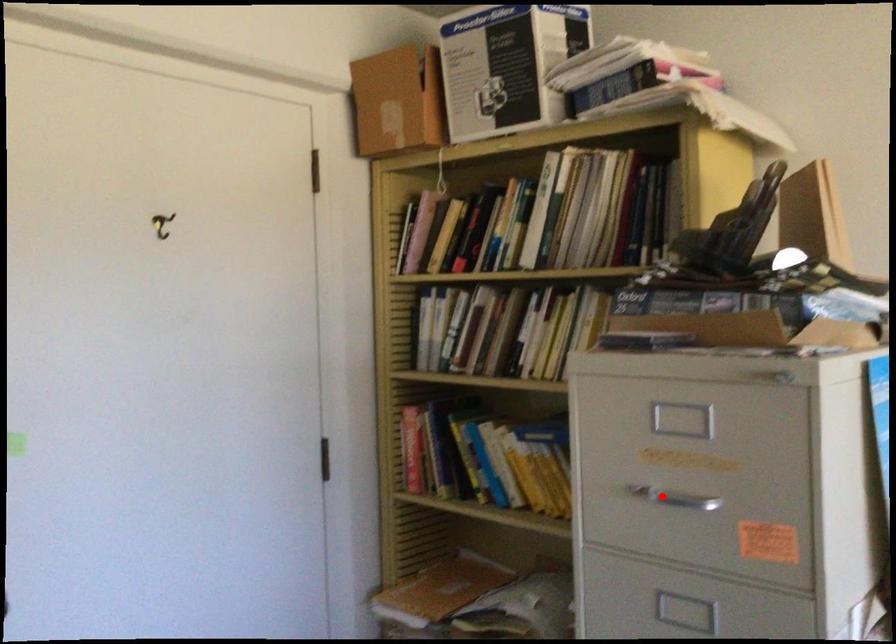
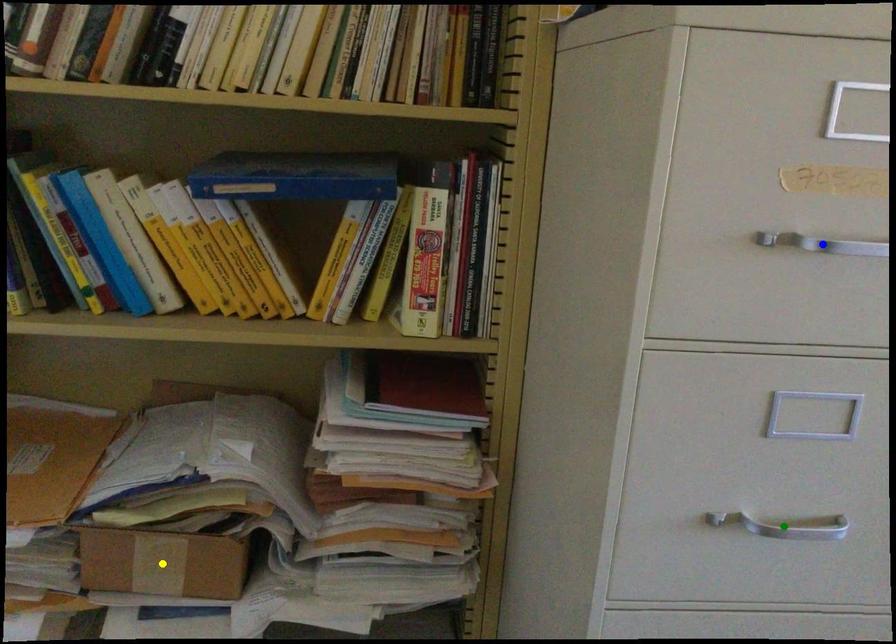
Question: I am providing you with two images of the same scene from different viewpoints. A red point is marked on the first image. You are given multiple points on the second image. Which mark in image 2 goes with the point in image 1?

Choices:
 (A) blue point
 (B) yellow point
 (C) green point

Answer: (A)